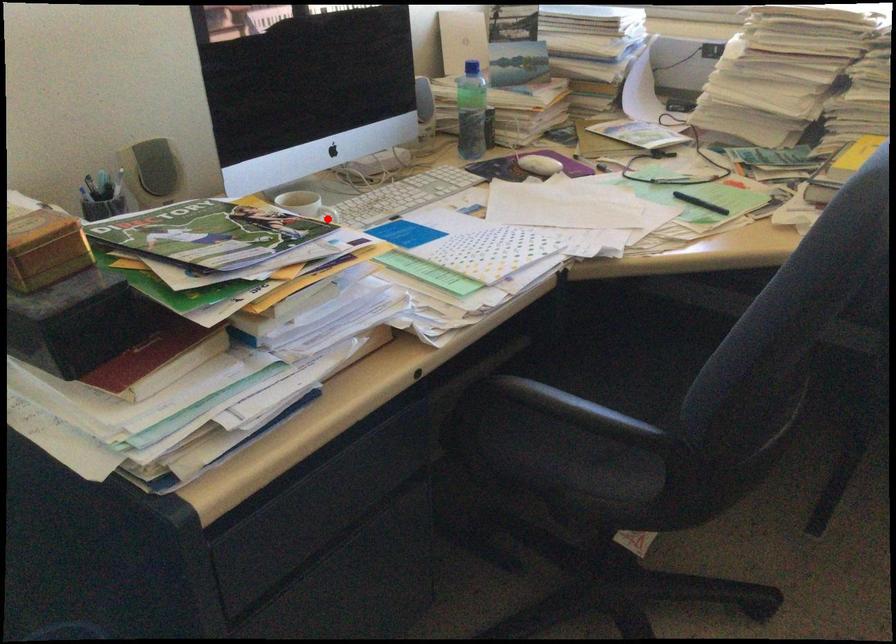
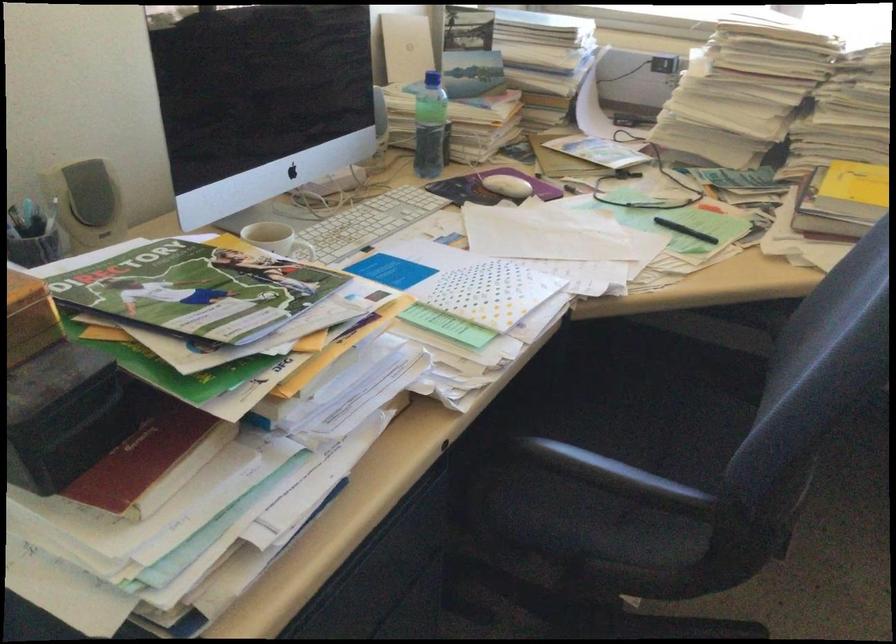
Question: I am providing you with two images of the same scene from different viewpoints. In image1, a red point is highlighted. Considering the same 3D point in image2, which of the following is correct?

Choices:
 (A) It is closer
 (B) It is farther

Answer: (A)